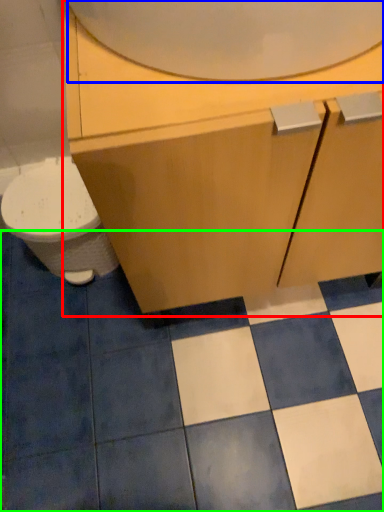
Question: Considering the real-world distances, which object is farthest from bathroom cabinet (highlighted by a red box)? mirror (highlighted by a blue box) or ceramic tile (highlighted by a green box)?

Choices:
 (A) mirror
 (B) ceramic tile

Answer: (B)